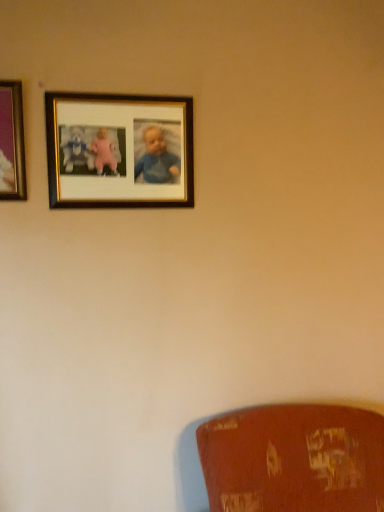
Question: From a real-world perspective, is metallic silver frame at upper left, the second picture frame from the right, above or below wooden photo frame at upper center, which ranks as the first picture frame in back-to-front order?

Choices:
 (A) below
 (B) above

Answer: (B)

Question: Considering the relative positions of metallic silver frame at upper left, marked as the first picture frame in a front-to-back arrangement, and wooden photo frame at upper center, which ranks as the 2th picture frame in front-to-back order, in the image provided, is metallic silver frame at upper left, marked as the first picture frame in a front-to-back arrangement, to the left or to the right of wooden photo frame at upper center, which ranks as the 2th picture frame in front-to-back order,?

Choices:
 (A) right
 (B) left

Answer: (B)

Question: From the image's perspective, is metallic silver frame at upper left, the first picture frame positioned from the left, above or below wooden photo frame at upper center, which ranks as the first picture frame in back-to-front order?

Choices:
 (A) below
 (B) above

Answer: (B)

Question: Choose the correct answer: Is wooden photo frame at upper center, which ranks as the 2th picture frame in front-to-back order, inside metallic silver frame at upper left, marked as the 2th picture frame in a back-to-front arrangement, or outside it?

Choices:
 (A) inside
 (B) outside

Answer: (B)

Question: In the image, is wooden photo frame at upper center, which is the second picture frame from left to right, positioned in front of or behind metallic silver frame at upper left, marked as the 2th picture frame in a back-to-front arrangement?

Choices:
 (A) front
 (B) behind

Answer: (B)

Question: From a real-world perspective, relative to metallic silver frame at upper left, the first picture frame positioned from the left, is wooden photo frame at upper center, which ranks as the 2th picture frame in front-to-back order, vertically above or below?

Choices:
 (A) below
 (B) above

Answer: (A)

Question: Looking at their shapes, would you say wooden photo frame at upper center, which is the first picture frame from right to left, is wider or thinner than metallic silver frame at upper left, the first picture frame positioned from the left?

Choices:
 (A) wide
 (B) thin

Answer: (B)